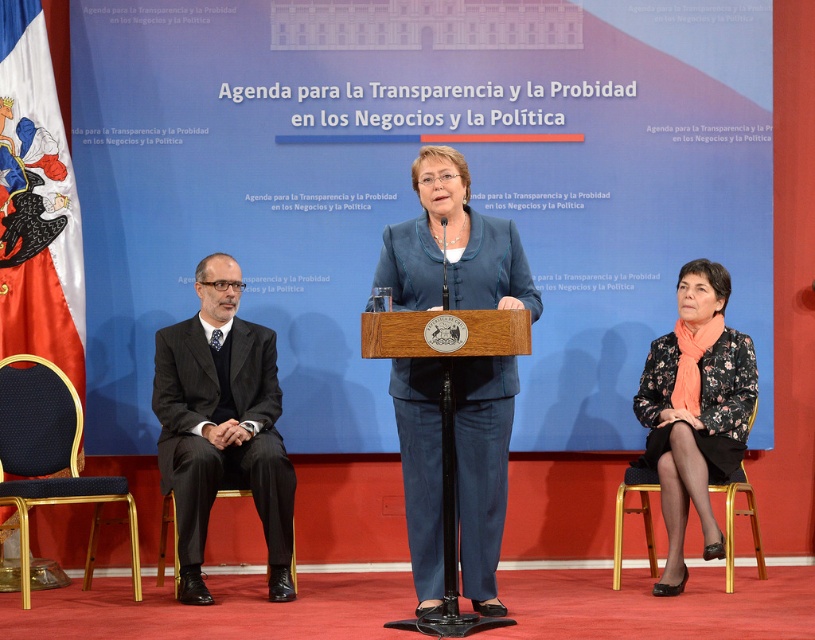
Between black suit at left and metallic gold chair at lower right, which one is positioned higher?

Positioned higher is black suit at left.

Looking at this image, is black suit at left smaller than metallic gold chair at lower right?

No.

Which is behind, point (197, 566) or point (615, 506)?

The point (615, 506) is more distant.

This screenshot has width=815, height=640. Find the location of `black suit at left`. black suit at left is located at coordinates (221, 426).

Is black fabric chair at lower left above metallic gold chair at lower right?

Yes, black fabric chair at lower left is above metallic gold chair at lower right.

Is black fabric chair at lower left shorter than metallic gold chair at lower right?

No, black fabric chair at lower left is not shorter than metallic gold chair at lower right.

Between point (21, 412) and point (644, 493), which one is positioned in front?

Point (21, 412)

The image size is (815, 640). In order to click on black fabric chair at lower left in this screenshot , I will do `click(51, 456)`.

Can you confirm if blue fabric business suit at center is positioned to the right of black fabric chair at lower left?

Yes, blue fabric business suit at center is to the right of black fabric chair at lower left.

The height and width of the screenshot is (640, 815). What are the coordinates of `blue fabric business suit at center` in the screenshot? It's located at (481, 467).